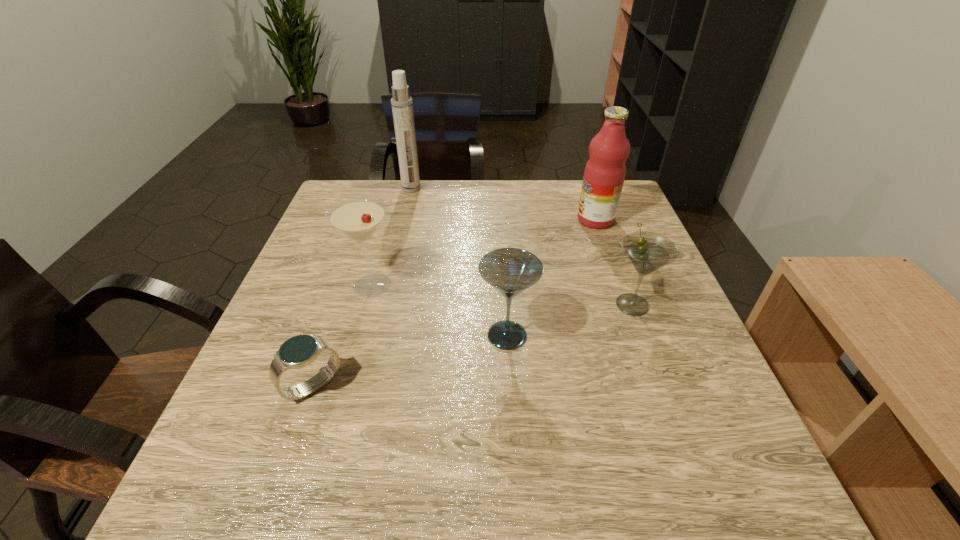
Locate an element on the screen. The height and width of the screenshot is (540, 960). the farthest object is located at coordinates (402, 106).

Identify the location of fruit juice. The image size is (960, 540). (604, 174).

Image resolution: width=960 pixels, height=540 pixels. What are the coordinates of `the leftmost martini` in the screenshot? It's located at (359, 218).

The width and height of the screenshot is (960, 540). Identify the location of the third object from right to left. (510, 271).

The image size is (960, 540). Identify the location of the rightmost martini. (647, 251).

Find the location of a particular element. watch is located at coordinates (301, 350).

Locate an element on the screen. This screenshot has height=540, width=960. the shortest object is located at coordinates (301, 350).

Identify the location of free space located on the front of the farthest object. The image size is (960, 540). (395, 262).

The image size is (960, 540). Find the location of `free space located 0.130m on the label of the second farthest object`. free space located 0.130m on the label of the second farthest object is located at coordinates (528, 220).

Find the location of a particular element. vacant space located on the label of the second farthest object is located at coordinates (468, 220).